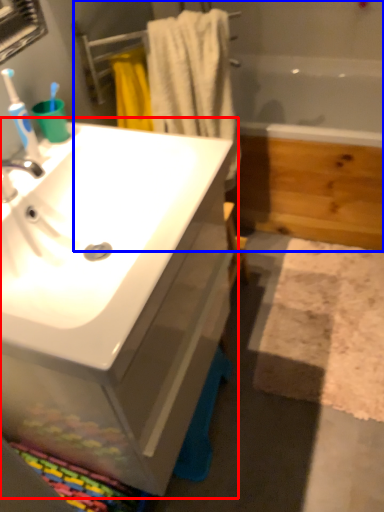
Question: Which object is further to the camera taking this photo, bathroom cabinet (highlighted by a red box) or bath (highlighted by a blue box)?

Choices:
 (A) bathroom cabinet
 (B) bath

Answer: (B)